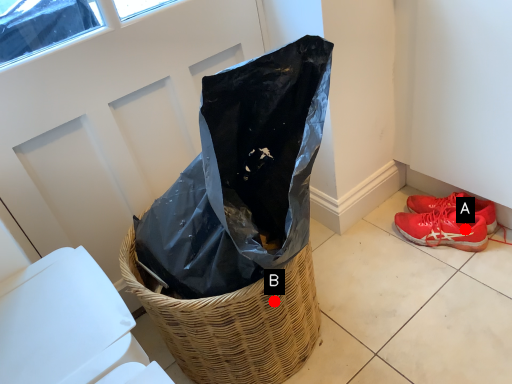
Question: Two points are circled on the image, labeled by A and B beside each circle. Which point appears farthest from the camera in this image?

Choices:
 (A) A is further
 (B) B is further

Answer: (A)